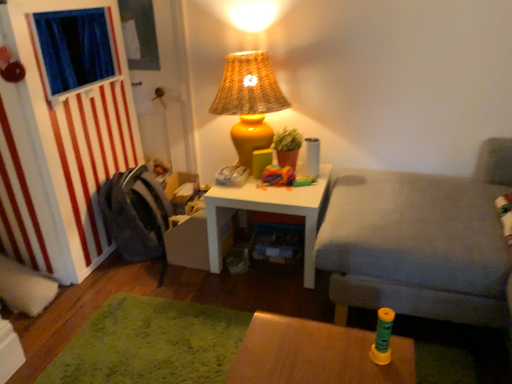
I want to click on free space above white matte table at center, which ranks as the 1th table in top-to-bottom order (from a real-world perspective), so click(279, 182).